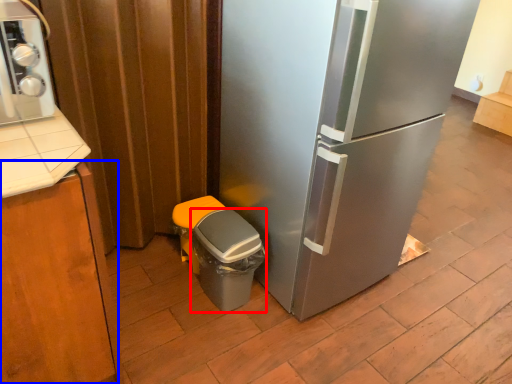
Question: Which object appears farthest to the camera in this image, potty (highlighted by a red box) or cabinetry (highlighted by a blue box)?

Choices:
 (A) potty
 (B) cabinetry

Answer: (A)